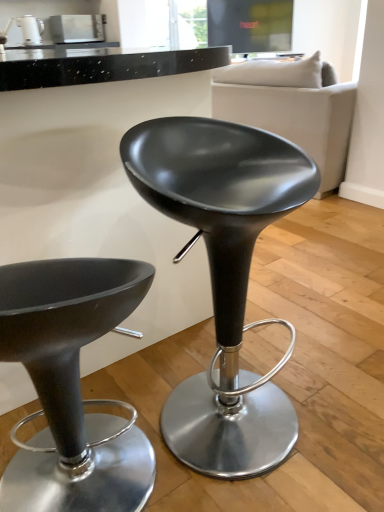
Question: From a real-world perspective, is soft beige fabric couch at upper right positioned under metallic stainless steel kettle at upper left, the 2th appliance in the left-to-right sequence, based on gravity?

Choices:
 (A) no
 (B) yes

Answer: (B)

Question: Is soft beige fabric couch at upper right at the right side of metallic stainless steel kettle at upper left, which ranks as the 1th appliance in right-to-left order?

Choices:
 (A) yes
 (B) no

Answer: (A)

Question: From the image's perspective, is soft beige fabric couch at upper right located above metallic stainless steel kettle at upper left, the 2th appliance in the left-to-right sequence?

Choices:
 (A) no
 (B) yes

Answer: (A)

Question: From the image's perspective, is soft beige fabric couch at upper right beneath metallic stainless steel kettle at upper left, which ranks as the 1th appliance in right-to-left order?

Choices:
 (A) no
 (B) yes

Answer: (B)

Question: Is soft beige fabric couch at upper right positioned in front of metallic stainless steel kettle at upper left, which ranks as the 1th appliance in right-to-left order?

Choices:
 (A) yes
 (B) no

Answer: (A)

Question: Is soft beige fabric couch at upper right further to camera compared to metallic stainless steel kettle at upper left, the 2th appliance in the left-to-right sequence?

Choices:
 (A) no
 (B) yes

Answer: (A)

Question: Is matte white kettle at upper left, the first appliance viewed from the left, surrounding soft beige fabric couch at upper right?

Choices:
 (A) yes
 (B) no

Answer: (B)

Question: Is matte white kettle at upper left, the first appliance viewed from the left, wider than soft beige fabric couch at upper right?

Choices:
 (A) yes
 (B) no

Answer: (B)

Question: From a real-world perspective, is matte white kettle at upper left, positioned as the 2th appliance in right-to-left order, physically below soft beige fabric couch at upper right?

Choices:
 (A) no
 (B) yes

Answer: (A)

Question: Considering the relative sizes of matte white kettle at upper left, positioned as the 2th appliance in right-to-left order, and soft beige fabric couch at upper right in the image provided, is matte white kettle at upper left, positioned as the 2th appliance in right-to-left order, taller than soft beige fabric couch at upper right?

Choices:
 (A) no
 (B) yes

Answer: (A)

Question: Does matte white kettle at upper left, positioned as the 2th appliance in right-to-left order, turn towards soft beige fabric couch at upper right?

Choices:
 (A) yes
 (B) no

Answer: (B)

Question: Is matte white kettle at upper left, positioned as the 2th appliance in right-to-left order, located outside soft beige fabric couch at upper right?

Choices:
 (A) yes
 (B) no

Answer: (A)

Question: Does soft beige fabric couch at upper right have a lesser width compared to matte white kettle at upper left, the first appliance viewed from the left?

Choices:
 (A) no
 (B) yes

Answer: (A)